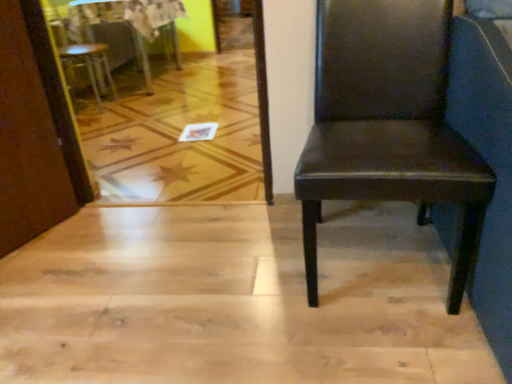
Question: In the image, is matte brown leather chair at right, which ranks as the 2th chair in back-to-front order, on the left side or the right side of wooden table at upper left?

Choices:
 (A) right
 (B) left

Answer: (A)

Question: In terms of height, does matte brown leather chair at right, the 2th chair from the left, look taller or shorter compared to wooden table at upper left?

Choices:
 (A) tall
 (B) short

Answer: (A)

Question: Which is farther from the wooden table at upper left?

Choices:
 (A) matte brown chair at upper left, positioned as the second chair in bottom-to-top order
 (B) matte brown leather chair at right, the 2th chair from the left

Answer: (B)

Question: Which object is positioned farthest from the matte brown chair at upper left, the 1th chair viewed from the left?

Choices:
 (A) matte brown leather chair at right, placed as the 1th chair when sorted from bottom to top
 (B) wooden table at upper left

Answer: (A)